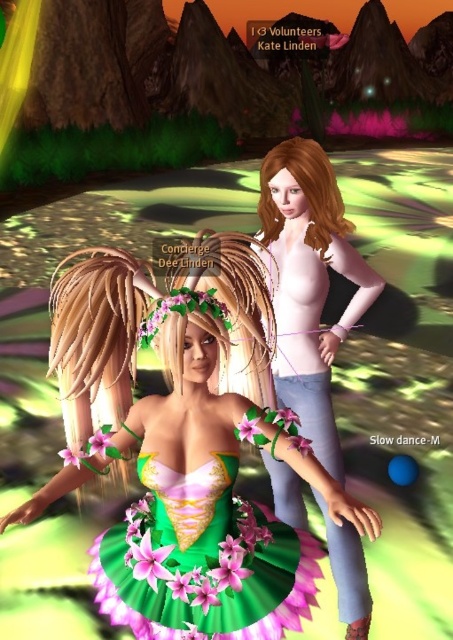
You are a character in the game and need to decide which dress to wear for an event. Both the green floral dress at center and the pink matte dress at center are options. According to their positions, which dress is located to the left?

The green floral dress at center is to the left of the pink matte dress at center, so the green floral dress at center is located to the left.